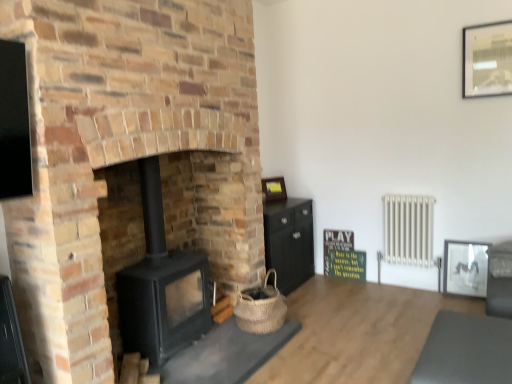
Question: Based on their sizes in the image, would you say matte gold picture frame at center, which is counted as the 2th picture frame, starting from the bottom, is bigger or smaller than metallic silver picture frame at upper right, the 3th picture frame from the left?

Choices:
 (A) big
 (B) small

Answer: (B)

Question: From a real-world perspective, is matte gold picture frame at center, which appears as the third picture frame when viewed from the right, positioned above or below metallic silver picture frame at upper right, which ranks as the first picture frame in top-to-bottom order?

Choices:
 (A) below
 (B) above

Answer: (A)

Question: Which of these objects is positioned farthest from the matte black picture frame at right, positioned as the 3th picture frame in top-to-bottom order?

Choices:
 (A) woven natural basket at lower center
 (B) white metallic radiator at right
 (C) green matte signboard at center
 (D) matte gold picture frame at center, which is the second picture frame from top to bottom
 (E) matte black wood stove at center

Answer: (E)

Question: Based on their relative distances, which object is farther from the matte black wood stove at center?

Choices:
 (A) metallic silver picture frame at upper right, acting as the first picture frame starting from the right
 (B) matte black picture frame at right, placed as the second picture frame when sorted from front to back
 (C) black matte wood burning stove at center-left
 (D) smooth gray mat at lower right
 (E) woven natural basket at lower center

Answer: (B)